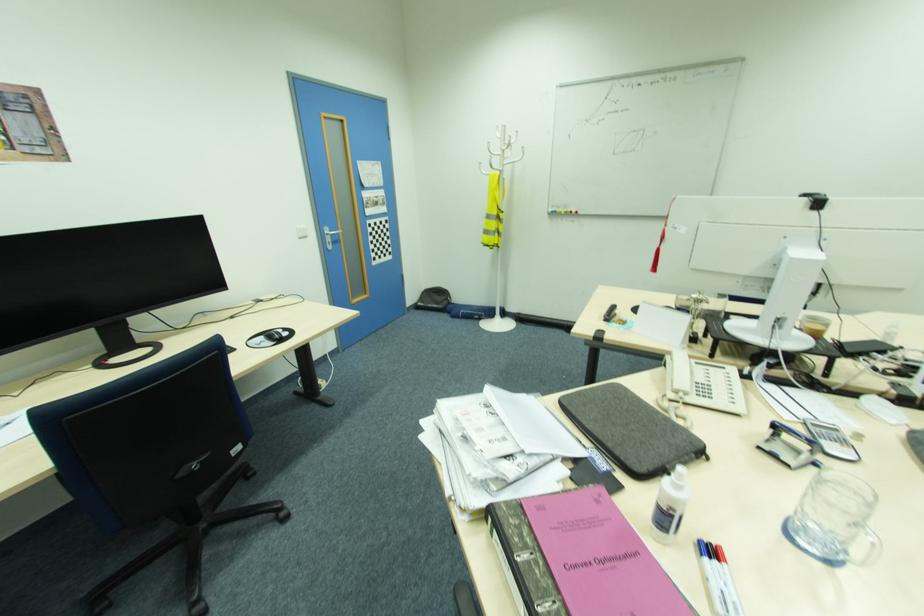
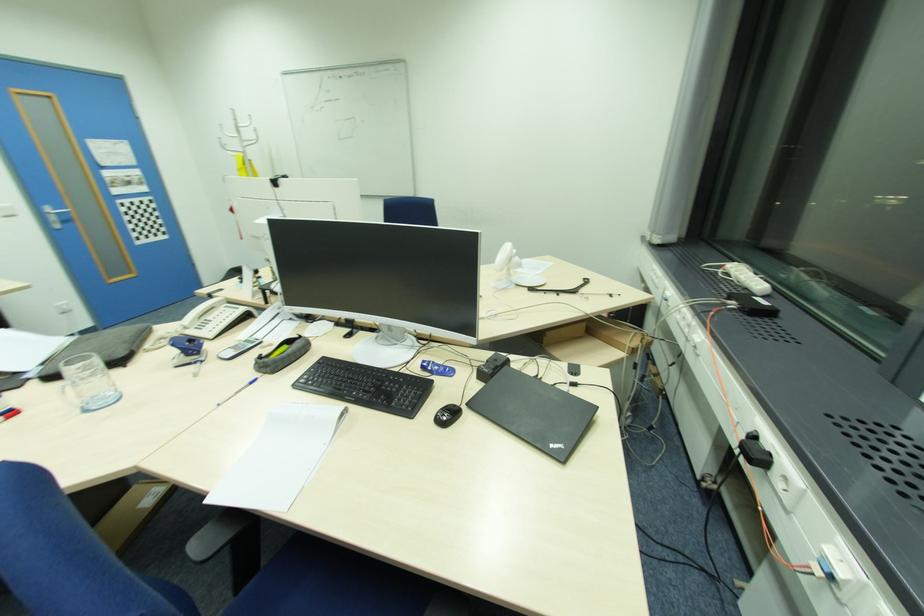
Where in the second image is the point corresponding to (331,233) from the first image?

(54, 213)